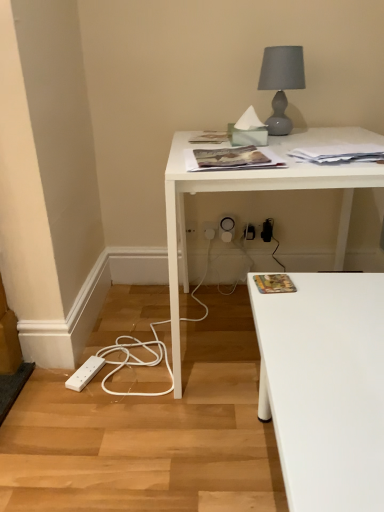
What do you see at coordinates (247, 191) in the screenshot? This screenshot has height=512, width=384. I see `white glossy desk at center` at bounding box center [247, 191].

Identify the location of white plastic extension cord at lower left. (85, 373).

How much space does white plastic electric outlet at lower center, placed as the 2th electric outlet when sorted from right to left, occupy vertically?

The height of white plastic electric outlet at lower center, placed as the 2th electric outlet when sorted from right to left, is 3.72 inches.

Image resolution: width=384 pixels, height=512 pixels. Identify the location of white plastic electric outlet at lower center, the second electric outlet positioned from the left. (210, 230).

The width and height of the screenshot is (384, 512). Identify the location of printed paper magazine at lower right, arranged as the 4th magazine when viewed from the top. (274, 283).

Who is smaller, white paper at upper right, placed as the 3th magazine when sorted from top to bottom, or white plastic electric outlet at lower center, the second electric outlet positioned from the left?

white plastic electric outlet at lower center, the second electric outlet positioned from the left, is smaller.

Considering the positions of objects white paper at upper right, which is the 2th magazine in back-to-front order, and white plastic electric outlet at lower center, the second electric outlet positioned from the left, in the image provided, who is more to the left, white paper at upper right, which is the 2th magazine in back-to-front order, or white plastic electric outlet at lower center, the second electric outlet positioned from the left,?

white plastic electric outlet at lower center, the second electric outlet positioned from the left.

From the picture: Which object is closer to the camera taking this photo, white paper at upper right, placed as the 3th magazine when sorted from top to bottom, or white plastic electric outlet at lower center, the first electric outlet when ordered from right to left?

white paper at upper right, placed as the 3th magazine when sorted from top to bottom, is more forward.

Are white paper at upper right, which is the 2th magazine in back-to-front order, and white plastic electric outlet at lower center, the first electric outlet when ordered from right to left, beside each other?

They are not placed beside each other.

Which is more to the right, printed paper magazine at lower right, arranged as the 4th magazine when viewed from the top, or white plastic electric outlet at lower center, the first electric outlet when ordered from right to left?

From the viewer's perspective, printed paper magazine at lower right, arranged as the 4th magazine when viewed from the top, appears more on the right side.

From the picture: Is printed paper magazine at lower right, placed as the 1th magazine when sorted from front to back, positioned beyond the bounds of white plastic electric outlet at lower center, the first electric outlet when ordered from right to left?

Yes, printed paper magazine at lower right, placed as the 1th magazine when sorted from front to back, is not within white plastic electric outlet at lower center, the first electric outlet when ordered from right to left.

Is printed paper magazine at lower right, the 1th magazine when ordered from bottom to top, shorter than white plastic electric outlet at lower center, the second electric outlet positioned from the left?

Yes.

Does point (280, 281) come farther from viewer compared to point (211, 233)?

No, (280, 281) is in front of (211, 233).

Can you confirm if white glossy desk at center is thinner than white plastic electric outlet at lower center, acting as the 1th electric outlet starting from the left?

No, white glossy desk at center is not thinner than white plastic electric outlet at lower center, acting as the 1th electric outlet starting from the left.

From a real-world perspective, which is physically above, white glossy desk at center or white plastic electric outlet at lower center, acting as the 1th electric outlet starting from the left?

white glossy desk at center, from a real-world perspective.

Is white glossy desk at center facing away from white plastic electric outlet at lower center, placed as the 2th electric outlet when sorted from right to left?

Yes, white glossy desk at center's orientation is away from white plastic electric outlet at lower center, placed as the 2th electric outlet when sorted from right to left.

Is white glossy desk at center not inside white plastic electric outlet at lower center, placed as the 2th electric outlet when sorted from right to left?

Absolutely, white glossy desk at center is external to white plastic electric outlet at lower center, placed as the 2th electric outlet when sorted from right to left.

Is printed paper magazine at upper center, the third magazine viewed from the back, positioned far away from white plastic extension cord at lower left?

No, printed paper magazine at upper center, the third magazine viewed from the back, is not far from white plastic extension cord at lower left.

Which is more to the right, printed paper magazine at upper center, which ranks as the 3th magazine in bottom-to-top order, or white plastic extension cord at lower left?

printed paper magazine at upper center, which ranks as the 3th magazine in bottom-to-top order.

From the picture: How far apart are printed paper magazine at upper center, the third magazine viewed from the back, and white plastic extension cord at lower left?

printed paper magazine at upper center, the third magazine viewed from the back, is 33.28 inches away from white plastic extension cord at lower left.

Does printed paper magazine at upper center, the third magazine viewed from the back, lie in front of white plastic extension cord at lower left?

That is True.

Is white plastic electric outlet at lower center, acting as the 1th electric outlet starting from the left, located within white paper at upper right, placed as the 3th magazine when sorted from top to bottom?

No, white plastic electric outlet at lower center, acting as the 1th electric outlet starting from the left, is not a part of white paper at upper right, placed as the 3th magazine when sorted from top to bottom.

Is white plastic electric outlet at lower center, placed as the 2th electric outlet when sorted from right to left, at the back of white paper at upper right, which is the 2th magazine in back-to-front order?

No, white paper at upper right, which is the 2th magazine in back-to-front order, is not facing the opposite direction of white plastic electric outlet at lower center, placed as the 2th electric outlet when sorted from right to left.

Based on their positions, is white paper at upper right, arranged as the second magazine when ordered from the bottom, located to the left or right of white plastic electric outlet at lower center, acting as the 1th electric outlet starting from the left?

Result: white paper at upper right, arranged as the second magazine when ordered from the bottom, is positioned on white plastic electric outlet at lower center, acting as the 1th electric outlet starting from the left,'s right side.

Which object is closer to the camera taking this photo, white plastic electric outlet at lower center, placed as the 2th electric outlet when sorted from right to left, or matte gray glass table lamp at upper right?

matte gray glass table lamp at upper right is closer to the camera.

Between white plastic electric outlet at lower center, acting as the 1th electric outlet starting from the left, and matte gray glass table lamp at upper right, which one has larger size?

Bigger between the two is matte gray glass table lamp at upper right.

From a real-world perspective, who is located higher, white plastic electric outlet at lower center, placed as the 2th electric outlet when sorted from right to left, or matte gray glass table lamp at upper right?

matte gray glass table lamp at upper right is physically above.

Considering the sizes of objects printed paper magazine at lower right, the 4th magazine from the back, and white glossy desk at center in the image provided, who is thinner, printed paper magazine at lower right, the 4th magazine from the back, or white glossy desk at center?

Thinner between the two is printed paper magazine at lower right, the 4th magazine from the back.

From the image's perspective, is printed paper magazine at lower right, placed as the 1th magazine when sorted from front to back, over white glossy desk at center?

Incorrect, from the image's perspective, printed paper magazine at lower right, placed as the 1th magazine when sorted from front to back, is lower than white glossy desk at center.

Considering the sizes of objects printed paper magazine at lower right, the 4th magazine from the back, and white glossy desk at center in the image provided, who is shorter, printed paper magazine at lower right, the 4th magazine from the back, or white glossy desk at center?

printed paper magazine at lower right, the 4th magazine from the back.

Locate an element on the screen. This screenshot has width=384, height=512. magazine that is the 3rd object to the right of the white plastic electric outlet at lower center, the second electric outlet positioned from the left, starting at the anchor is located at coordinates (339, 154).

Which electric outlet is the 1st one when counting from the left side of the printed paper magazine at lower right, the 4th magazine from the back? Please provide its 2D coordinates.

[(210, 230)]

Considering their positions, is white paper at upper right, which is the 2th magazine in back-to-front order, positioned closer to matte paper magazine at center, the first magazine from the back, than printed paper magazine at lower right, placed as the 1th magazine when sorted from front to back?

Based on the image, white paper at upper right, which is the 2th magazine in back-to-front order, appears to be nearer to matte paper magazine at center, the first magazine from the back.

Consider the image. Considering their positions, is white plastic electric outlet at lower center, the second electric outlet positioned from the left, positioned further to printed paper magazine at upper center, marked as the second magazine in a front-to-back arrangement, than white plastic extension cord at lower left?

The object further to printed paper magazine at upper center, marked as the second magazine in a front-to-back arrangement, is white plastic extension cord at lower left.

Estimate the real-world distances between objects in this image. Which object is further from white paper at upper right, placed as the 3th magazine when sorted from top to bottom, white plastic electric outlet at lower center, placed as the 2th electric outlet when sorted from right to left, or printed paper magazine at lower right, the 4th magazine from the back?

white plastic electric outlet at lower center, placed as the 2th electric outlet when sorted from right to left, is positioned further to the anchor white paper at upper right, placed as the 3th magazine when sorted from top to bottom.

From the image, which object appears to be farther from matte gray glass table lamp at upper right, printed paper magazine at upper center, marked as the second magazine in a front-to-back arrangement, or matte paper magazine at center, the first magazine from the back?

printed paper magazine at upper center, marked as the second magazine in a front-to-back arrangement, lies further to matte gray glass table lamp at upper right than the other object.

When comparing their distances from printed paper magazine at lower right, arranged as the 4th magazine when viewed from the top, does printed paper magazine at upper center, the second magazine from the top, or white glossy desk at center seem further?

white glossy desk at center.

When comparing their distances from matte paper magazine at center, which is the 1th magazine in top-to-bottom order, does matte gray glass table lamp at upper right or white glossy desk at center seem closer?

Based on the image, matte gray glass table lamp at upper right appears to be nearer to matte paper magazine at center, which is the 1th magazine in top-to-bottom order.

Based on the photo, which object lies further to the anchor point white plastic electric outlet at lower center, acting as the 1th electric outlet starting from the left, matte paper magazine at center, which is the 1th magazine in top-to-bottom order, or matte gray glass table lamp at upper right?

matte gray glass table lamp at upper right is positioned further to the anchor white plastic electric outlet at lower center, acting as the 1th electric outlet starting from the left.

Considering their positions, is white paper at upper right, arranged as the second magazine when ordered from the bottom, positioned closer to white plastic extension cord at lower left than matte paper magazine at center, positioned as the 4th magazine in bottom-to-top order?

Based on the image, matte paper magazine at center, positioned as the 4th magazine in bottom-to-top order, appears to be nearer to white plastic extension cord at lower left.

I want to click on desk that lies between matte paper magazine at center, which is the 1th magazine in top-to-bottom order, and printed paper magazine at lower right, the 4th magazine from the back, from top to bottom, so click(247, 191).

Find the location of `magazine between printed paper magazine at upper center, which ranks as the 3th magazine in bottom-to-top order, and matte gray glass table lamp at upper right in the front-back direction`. magazine between printed paper magazine at upper center, which ranks as the 3th magazine in bottom-to-top order, and matte gray glass table lamp at upper right in the front-back direction is located at coordinates (339, 154).

Where is `extension cord between white glossy desk at center and white plastic electric outlet at lower center, placed as the 2th electric outlet when sorted from right to left, from front to back`? This screenshot has height=512, width=384. extension cord between white glossy desk at center and white plastic electric outlet at lower center, placed as the 2th electric outlet when sorted from right to left, from front to back is located at coordinates (85, 373).

This screenshot has height=512, width=384. Identify the location of extension cord positioned between printed paper magazine at upper center, the second magazine from the top, and white plastic electric outlet at lower center, the second electric outlet positioned from the left, from near to far. (85, 373).